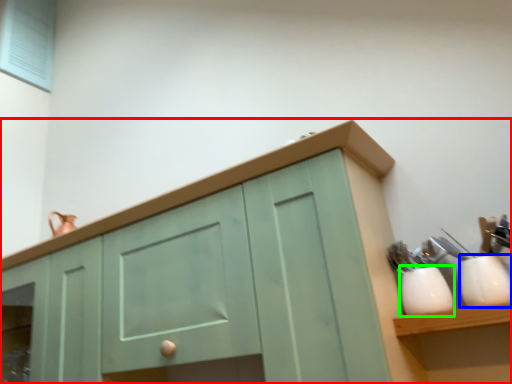
Question: Estimate the real-world distances between objects in this image. Which object is farther from cabinetry (highlighted by a red box), tableware (highlighted by a blue box) or tableware (highlighted by a green box)?

Choices:
 (A) tableware
 (B) tableware

Answer: (A)